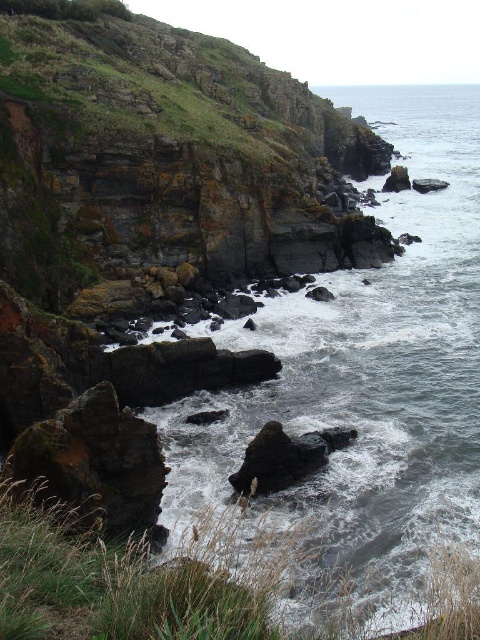
Does gray rocky water at center have a greater height compared to smooth dark rock at center?

Yes.

Consider the image. Is gray rocky water at center above smooth dark rock at center?

Indeed, gray rocky water at center is positioned over smooth dark rock at center.

Is point (454, 282) in front of point (311, 435)?

No, it is behind (311, 435).

This screenshot has height=640, width=480. Identify the location of gray rocky water at center. (368, 376).